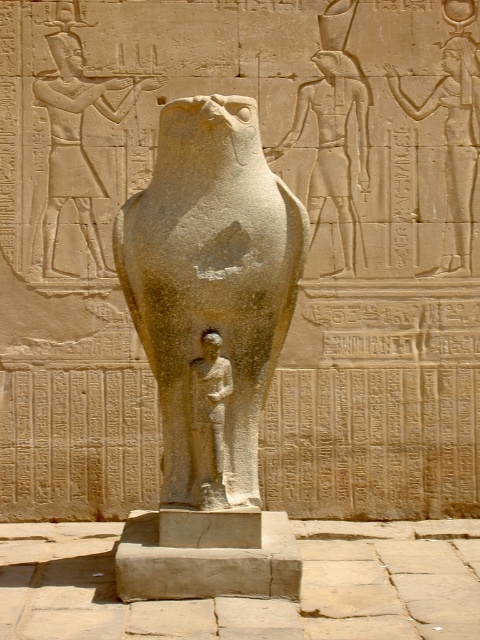
What are the coordinates of the gray stone falcon at center?

The gray stone falcon at center is located at point (211, 291).

You are an archaeologist examining the ancient Egyptian sculpture. You notice the gray stone statue at center and the sandstone relief figure at upper left. Based on their positions, which one is placed higher up in the image?

The gray stone statue at center is above the sandstone relief figure at upper left, so it is placed higher up in the image.